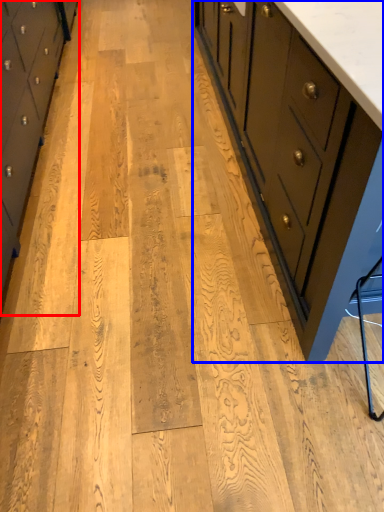
Question: Which object appears farthest to the camera in this image, chest of drawers (highlighted by a red box) or chest of drawers (highlighted by a blue box)?

Choices:
 (A) chest of drawers
 (B) chest of drawers

Answer: (A)